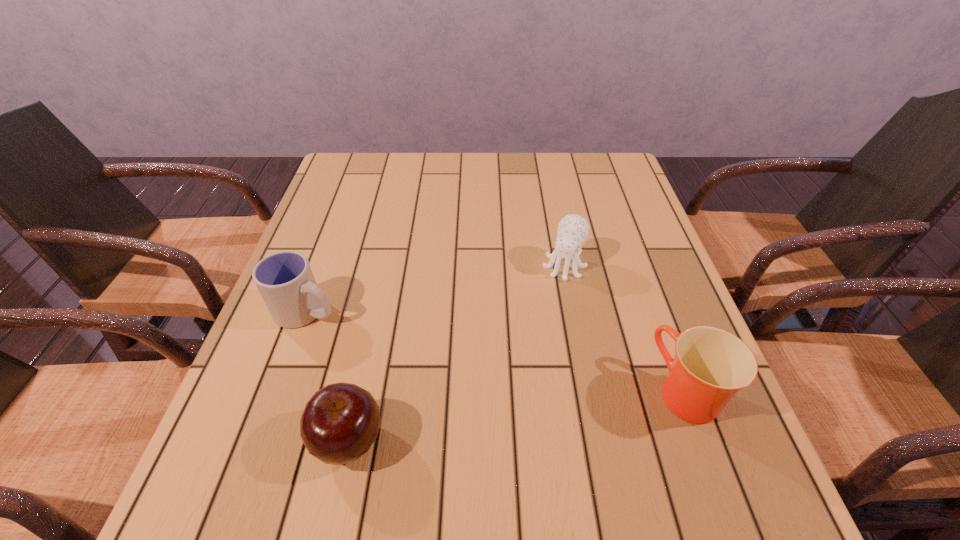
This screenshot has height=540, width=960. I want to click on apple, so click(x=340, y=422).

In order to click on the nearer cup in this screenshot , I will do `click(711, 365)`.

Identify the location of the right cup. The width and height of the screenshot is (960, 540). (711, 365).

I want to click on the second farthest object, so click(285, 280).

Image resolution: width=960 pixels, height=540 pixels. I want to click on the leftmost object, so click(285, 280).

In order to click on the farthest object in this screenshot , I will do `click(573, 229)`.

The width and height of the screenshot is (960, 540). Identify the location of the second object from right to left. (573, 229).

Where is `blank area located on the left of the second object from left to right`? Image resolution: width=960 pixels, height=540 pixels. blank area located on the left of the second object from left to right is located at coordinates (278, 441).

Find the location of a particular element. This screenshot has width=960, height=540. free space located on the back of the rightmost object is located at coordinates (657, 312).

Locate an element on the screen. The image size is (960, 540). free point located with the handle on the side of the third nearest object is located at coordinates (381, 343).